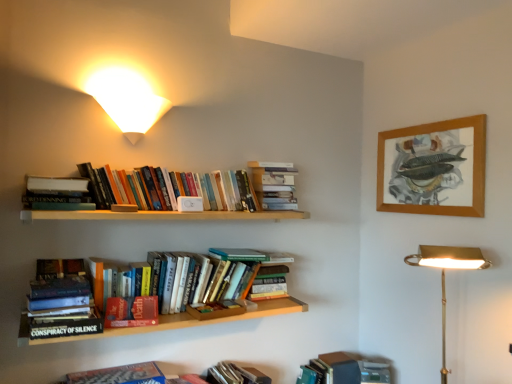
Where is `free space above wooden picture frame at upper right (from a real-world perspective)`? The width and height of the screenshot is (512, 384). free space above wooden picture frame at upper right (from a real-world perspective) is located at coordinates (424, 122).